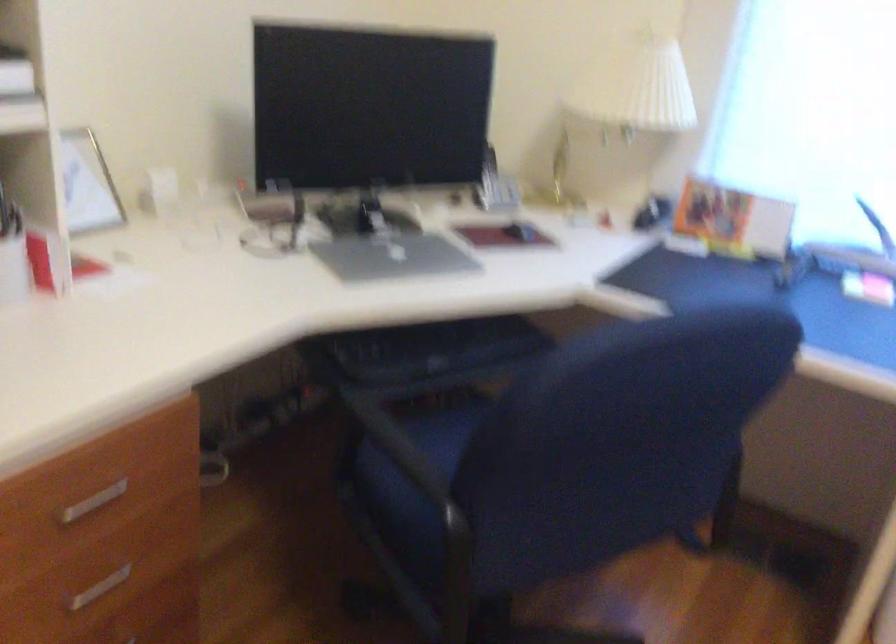
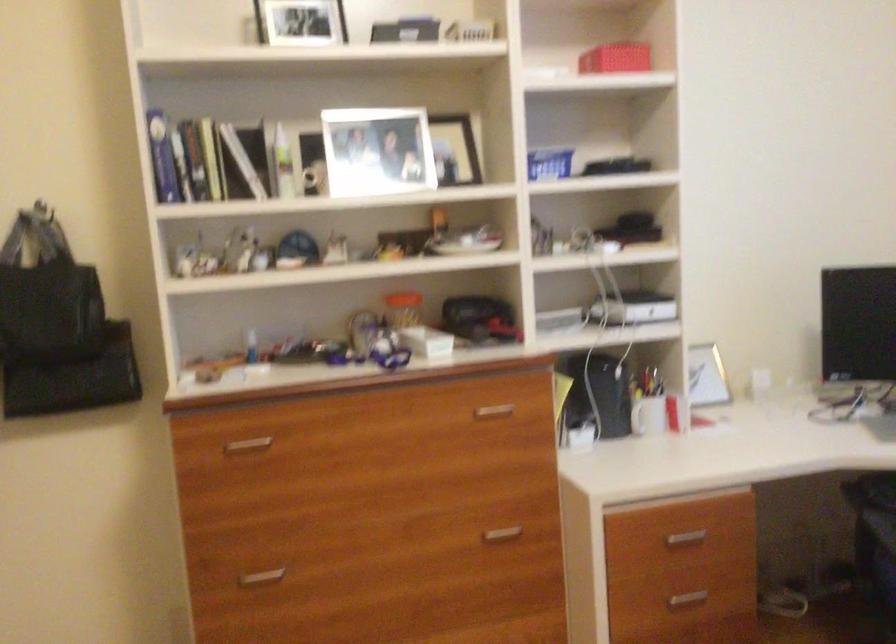
Question: The first image is from the beginning of the video and the second image is from the end. How did the camera likely rotate when shooting the video?

Choices:
 (A) Left
 (B) Right
 (C) Up
 (D) Down

Answer: (A)